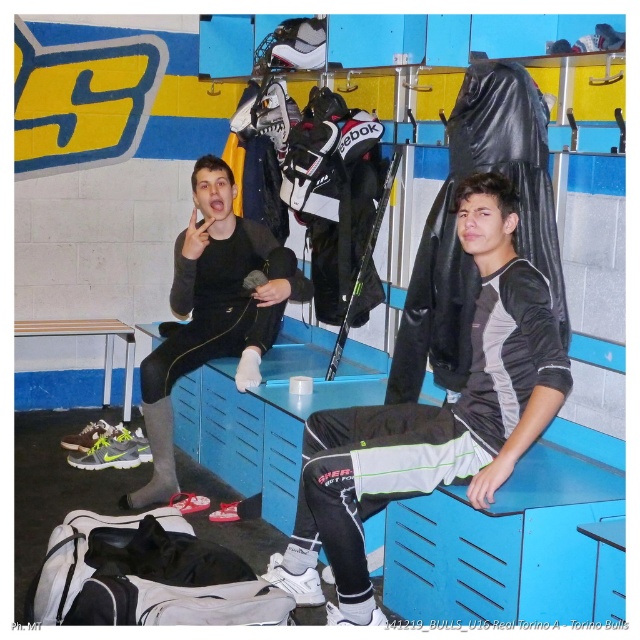
Between black matte jacket at center and matte black jacket at center, which one appears on the right side from the viewer's perspective?

From the viewer's perspective, black matte jacket at center appears more on the right side.

Does black matte jacket at center have a larger size compared to matte black jacket at center?

Actually, black matte jacket at center might be smaller than matte black jacket at center.

Between point (477, 332) and point (243, 355), which one is positioned behind?

Positioned behind is point (243, 355).

Where is `black matte jacket at center`? black matte jacket at center is located at coordinates (432, 419).